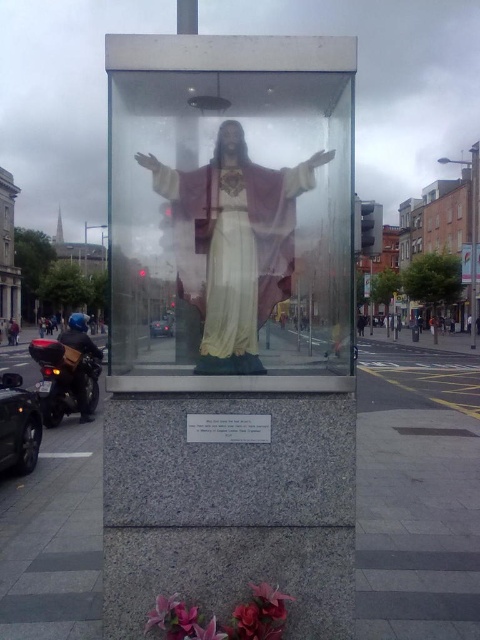
Question: Can you confirm if matte gold statue at center is positioned to the left of shiny black motorcycle at lower left?

Choices:
 (A) no
 (B) yes

Answer: (A)

Question: Which of the following is the closest to the observer?

Choices:
 (A) red leather jacket at lower left
 (B) matte gold statue at center

Answer: (B)

Question: Which point is closer to the camera taking this photo?

Choices:
 (A) (98, 348)
 (B) (15, 323)
 (C) (260, 253)

Answer: (C)

Question: Which of the following is the closest to the observer?

Choices:
 (A) (13, 342)
 (B) (291, 170)
 (C) (68, 356)

Answer: (B)

Question: Is matte gold statue at center positioned behind shiny black motorcycle at lower left?

Choices:
 (A) yes
 (B) no

Answer: (B)

Question: Is shiny black motorcycle at lower left to the left of red leather jacket at lower left from the viewer's perspective?

Choices:
 (A) no
 (B) yes

Answer: (A)